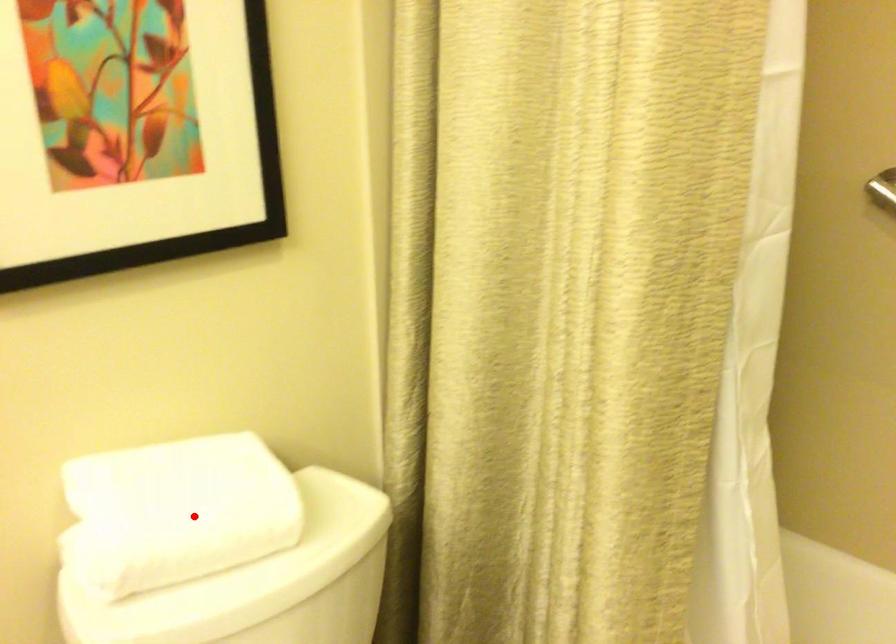
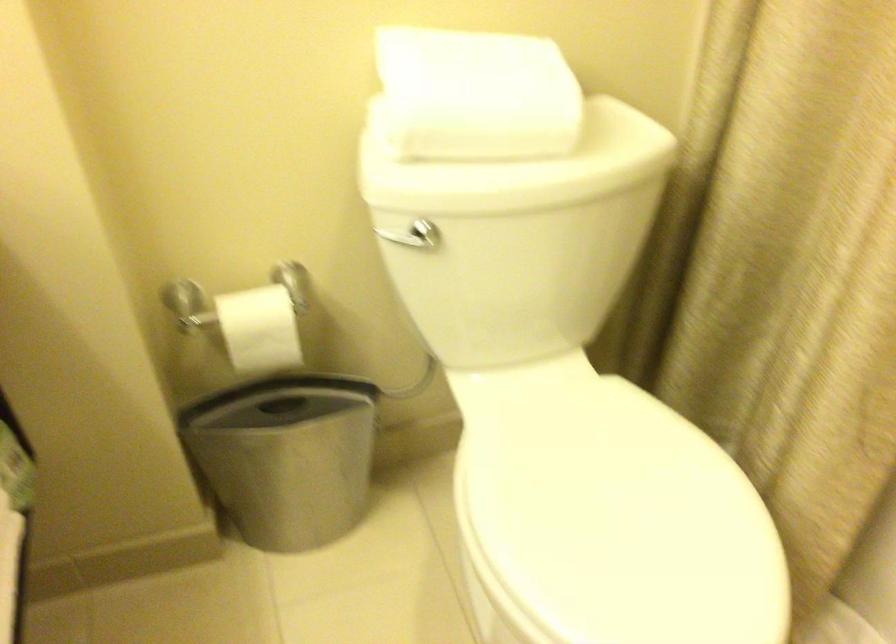
Where in the second image is the point corresponding to the highlighted location from the first image?

(476, 95)